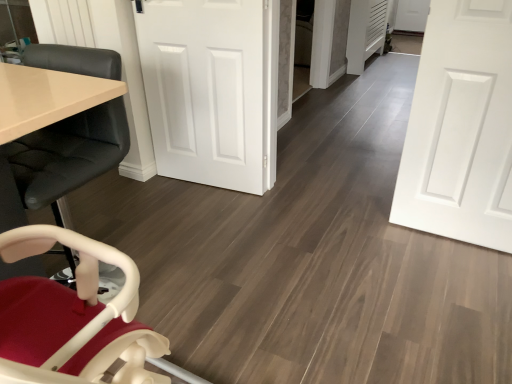
I want to click on white smooth door at center, acting as the first door starting from the left, so click(x=212, y=89).

Consider the image. Measure the distance between point (26, 207) and camera.

The distance of point (26, 207) from camera is 1.22 meters.

Describe the element at coordinates (461, 127) in the screenshot. I see `white matte door at center, which is the first door in right-to-left order` at that location.

Where is `white smooth door at center, acting as the first door starting from the left`? The width and height of the screenshot is (512, 384). white smooth door at center, acting as the first door starting from the left is located at coordinates (212, 89).

Does white matte door at center, placed as the second door when sorted from left to right, have a greater height compared to white smooth door at center, acting as the first door starting from the left?

Yes, white matte door at center, placed as the second door when sorted from left to right, is taller than white smooth door at center, acting as the first door starting from the left.

Considering the points (408, 163) and (263, 90), which point is behind, point (408, 163) or point (263, 90)?

The point (263, 90) is farther from the camera.

Is the position of white matte door at center, which is the first door in right-to-left order, more distant than that of white smooth door at center, marked as the 2th door in a right-to-left arrangement?

No, white matte door at center, which is the first door in right-to-left order, is in front of white smooth door at center, marked as the 2th door in a right-to-left arrangement.

Could you tell me if matte black chair at left is facing white smooth door at center, acting as the first door starting from the left?

No, matte black chair at left is not turned towards white smooth door at center, acting as the first door starting from the left.

Is matte black chair at left next to white smooth door at center, acting as the first door starting from the left, and touching it?

No, matte black chair at left is not next to white smooth door at center, acting as the first door starting from the left.

Is matte black chair at left smaller than white smooth door at center, acting as the first door starting from the left?

Actually, matte black chair at left might be larger than white smooth door at center, acting as the first door starting from the left.

Considering the positions of objects matte black chair at left and white smooth door at center, marked as the 2th door in a right-to-left arrangement, in the image provided, who is in front, matte black chair at left or white smooth door at center, marked as the 2th door in a right-to-left arrangement,?

Positioned in front is matte black chair at left.

Measure the distance from matte black chair at left to white matte door at center, which is the first door in right-to-left order.

1.37 meters.

Based on the photo, based on their sizes in the image, would you say matte black chair at left is bigger or smaller than white matte door at center, which is the first door in right-to-left order?

matte black chair at left is bigger than white matte door at center, which is the first door in right-to-left order.

Which is correct: matte black chair at left is inside white matte door at center, which is the first door in right-to-left order, or outside of it?

matte black chair at left is located beyond the bounds of white matte door at center, which is the first door in right-to-left order.

Based on their positions, is matte black chair at left located to the left or right of white matte door at center, placed as the second door when sorted from left to right?

matte black chair at left is positioned on white matte door at center, placed as the second door when sorted from left to right,'s left side.

Considering the relative sizes of white smooth door at center, marked as the 2th door in a right-to-left arrangement, and white matte door at center, which is the first door in right-to-left order, in the image provided, is white smooth door at center, marked as the 2th door in a right-to-left arrangement, smaller than white matte door at center, which is the first door in right-to-left order,?

No, white smooth door at center, marked as the 2th door in a right-to-left arrangement, is not smaller than white matte door at center, which is the first door in right-to-left order.

From the picture: Can you confirm if white smooth door at center, acting as the first door starting from the left, is thinner than white matte door at center, placed as the second door when sorted from left to right?

Incorrect, the width of white smooth door at center, acting as the first door starting from the left, is not less than that of white matte door at center, placed as the second door when sorted from left to right.

Is white matte door at center, which is the first door in right-to-left order, bigger than matte black chair at left?

Actually, white matte door at center, which is the first door in right-to-left order, might be smaller than matte black chair at left.

Locate an element on the screen. This screenshot has width=512, height=384. chair below the white matte door at center, placed as the second door when sorted from left to right (from a real-world perspective) is located at coordinates (63, 159).

In the scene shown: Can you confirm if white matte door at center, placed as the second door when sorted from left to right, is wider than matte black chair at left?

Incorrect, the width of white matte door at center, placed as the second door when sorted from left to right, does not surpass that of matte black chair at left.

Is white matte door at center, placed as the second door when sorted from left to right, positioned beyond the bounds of matte black chair at left?

That's correct, white matte door at center, placed as the second door when sorted from left to right, is outside of matte black chair at left.

Visually, is white smooth door at center, marked as the 2th door in a right-to-left arrangement, positioned to the left or to the right of matte black chair at left?

In the image, white smooth door at center, marked as the 2th door in a right-to-left arrangement, appears on the right side of matte black chair at left.

This screenshot has width=512, height=384. In the image, there is a white smooth door at center, acting as the first door starting from the left. Find the location of `chair below it (from the image's perspective)`. chair below it (from the image's perspective) is located at coordinates (63, 159).

Consider the image. Is white smooth door at center, marked as the 2th door in a right-to-left arrangement, looking in the opposite direction of matte black chair at left?

No.

Which is behind, point (181, 172) or point (106, 49)?

The point (181, 172) is farther.

Identify the location of door behind the white matte door at center, which is the first door in right-to-left order. The width and height of the screenshot is (512, 384). (212, 89).

You are a GUI agent. You are given a task and a screenshot of the screen. Output one action in this format:
    pyautogui.click(x=<x>, y=<y>)
    Task: Click on the chair on the left of the white smooth door at center, marked as the 2th door in a right-to-left arrangement
    
    Given the screenshot: What is the action you would take?
    pyautogui.click(x=63, y=159)

Considering their positions, is white matte door at center, placed as the second door when sorted from left to right, positioned closer to matte black chair at left than white smooth door at center, marked as the 2th door in a right-to-left arrangement?

white smooth door at center, marked as the 2th door in a right-to-left arrangement, is closer to matte black chair at left.

From the image, which object appears to be nearer to white matte door at center, placed as the second door when sorted from left to right, white smooth door at center, marked as the 2th door in a right-to-left arrangement, or matte black chair at left?

Based on the image, white smooth door at center, marked as the 2th door in a right-to-left arrangement, appears to be nearer to white matte door at center, placed as the second door when sorted from left to right.

When comparing their distances from white matte door at center, which is the first door in right-to-left order, does matte black chair at left or white smooth door at center, acting as the first door starting from the left, seem closer?

Among the two, white smooth door at center, acting as the first door starting from the left, is located nearer to white matte door at center, which is the first door in right-to-left order.

Looking at the image, which one is located closer to white smooth door at center, marked as the 2th door in a right-to-left arrangement, matte black chair at left or white matte door at center, which is the first door in right-to-left order?

matte black chair at left is closer to white smooth door at center, marked as the 2th door in a right-to-left arrangement.

From the image, which object appears to be farther from matte black chair at left, white smooth door at center, acting as the first door starting from the left, or white matte door at center, placed as the second door when sorted from left to right?

white matte door at center, placed as the second door when sorted from left to right.

From the picture: Considering their positions, is white matte door at center, which is the first door in right-to-left order, positioned closer to white smooth door at center, acting as the first door starting from the left, than matte black chair at left?

The object closer to white smooth door at center, acting as the first door starting from the left, is matte black chair at left.

Where is `door situated between matte black chair at left and white matte door at center, placed as the second door when sorted from left to right, from left to right`? This screenshot has height=384, width=512. door situated between matte black chair at left and white matte door at center, placed as the second door when sorted from left to right, from left to right is located at coordinates (212, 89).